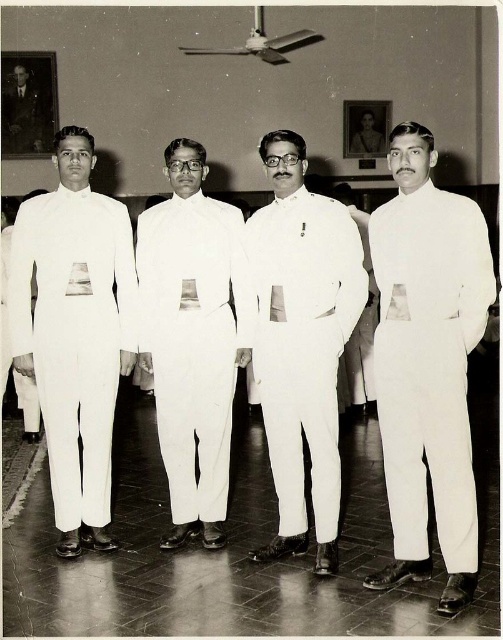
Is point (79, 172) closer to camera compared to point (14, 120)?

Yes, point (79, 172) is closer to viewer.

What do you see at coordinates (74, 332) in the screenshot?
I see `white smooth suit at left` at bounding box center [74, 332].

Where is `white smooth suit at left`? white smooth suit at left is located at coordinates (74, 332).

Which is more to the right, white smooth suit at left or white smooth suit at center?

white smooth suit at center is more to the right.

Who is more distant from viewer, (103, 538) or (176, 488)?

Point (176, 488)

Identify the location of white smooth suit at left. The height and width of the screenshot is (640, 503). (74, 332).

Does white smooth uniform at center have a greater height compared to white matte suit at center?

No, white smooth uniform at center is not taller than white matte suit at center.

In the scene shown: Who is lower down, white smooth uniform at center or white matte suit at center?

white smooth uniform at center is lower down.

Between point (290, 484) and point (368, 259), which one is positioned in front?

Positioned in front is point (290, 484).

Identify the location of white smooth uniform at center. (301, 340).